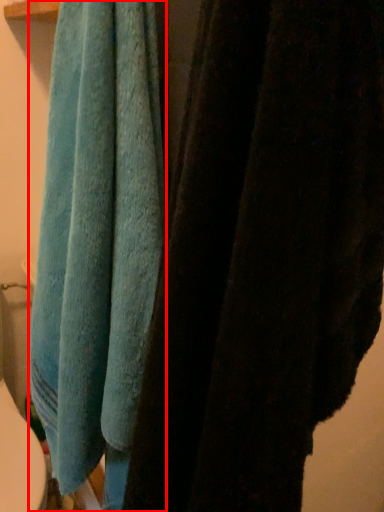
Question: From the image's perspective, what is the correct spatial positioning of towel (annotated by the red box) in reference to towel?

Choices:
 (A) above
 (B) below

Answer: (A)